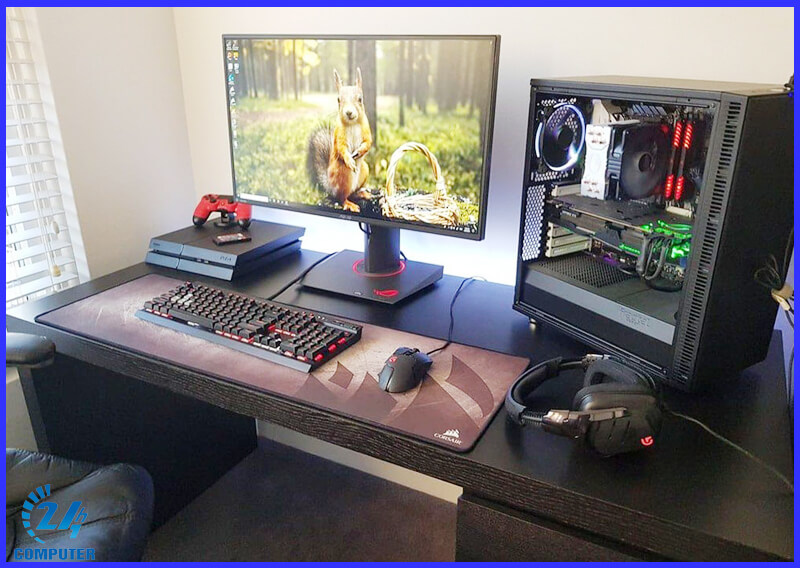
Find the location of a particular element. The height and width of the screenshot is (568, 800). game controller is located at coordinates (210, 198).